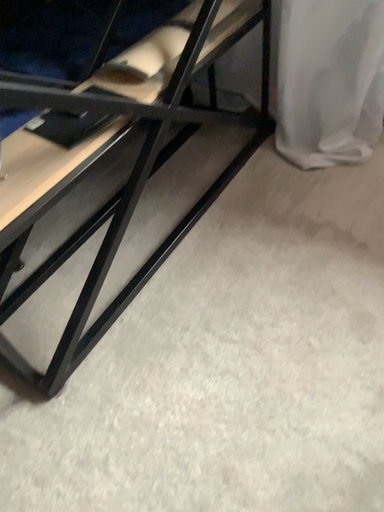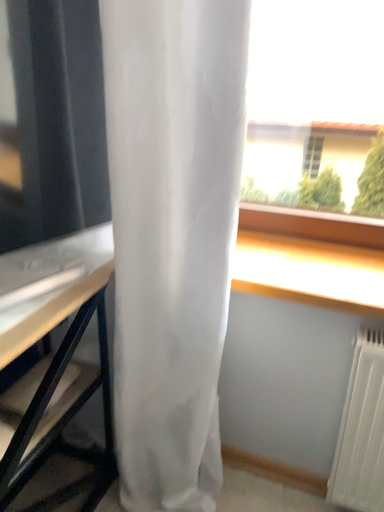
Question: Which way did the camera rotate in the video?

Choices:
 (A) rotated left
 (B) rotated right

Answer: (B)